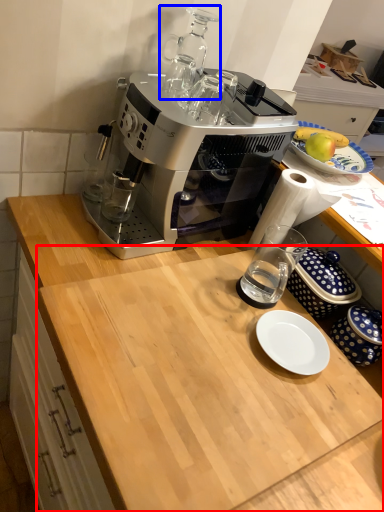
Question: Among these objects, which one is nearest to the camera, counter top (highlighted by a red box) or appliance (highlighted by a blue box)?

Choices:
 (A) counter top
 (B) appliance

Answer: (A)